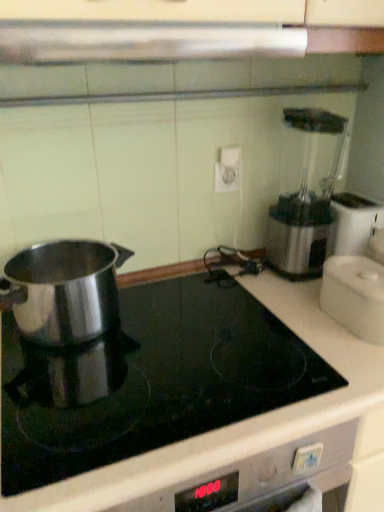
Identify the location of vacant area located to the right-hand side of polished stainless steel pot at left, arranged as the 1th kitchen appliance when viewed from the left. The width and height of the screenshot is (384, 512). (193, 316).